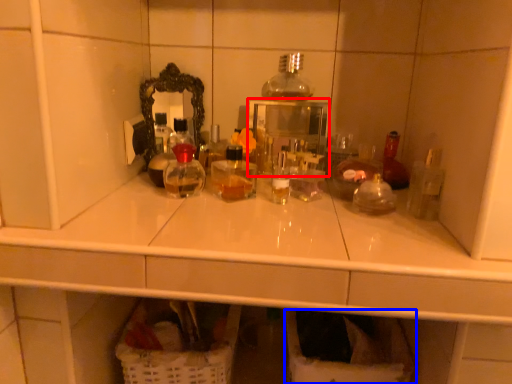
Question: Among these objects, which one is farthest to the camera, medicine cabinet (highlighted by a red box) or laundry basket (highlighted by a blue box)?

Choices:
 (A) medicine cabinet
 (B) laundry basket

Answer: (A)